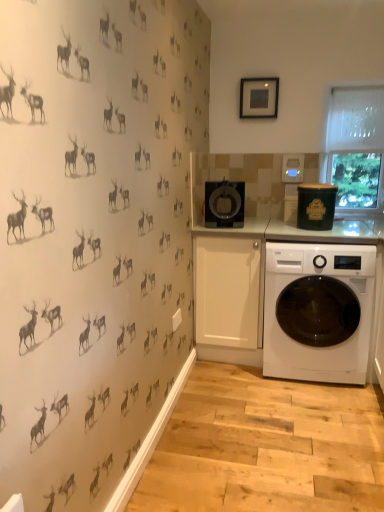
Question: In which direction should I rotate to look at black glossy coffee maker at center, the 1th appliance positioned from the left?

Choices:
 (A) left
 (B) right

Answer: (B)

Question: Is black glossy coffee maker at center, the 1th appliance positioned from the left, positioned beyond the bounds of matte black picture frame at upper center?

Choices:
 (A) no
 (B) yes

Answer: (B)

Question: From the image's perspective, is black glossy coffee maker at center, the 1th appliance positioned from the left, located above matte black picture frame at upper center?

Choices:
 (A) yes
 (B) no

Answer: (B)

Question: Is black glossy coffee maker at center, the 1th appliance positioned from the left, thinner than matte black picture frame at upper center?

Choices:
 (A) no
 (B) yes

Answer: (A)

Question: Can you confirm if black glossy coffee maker at center, the 1th appliance positioned from the left, is taller than matte black picture frame at upper center?

Choices:
 (A) no
 (B) yes

Answer: (B)

Question: Considering the relative sizes of black glossy coffee maker at center, which ranks as the 2th appliance in right-to-left order, and matte black picture frame at upper center in the image provided, is black glossy coffee maker at center, which ranks as the 2th appliance in right-to-left order, smaller than matte black picture frame at upper center?

Choices:
 (A) no
 (B) yes

Answer: (A)

Question: Is matte black picture frame at upper center surrounded by black glossy coffee maker at center, which ranks as the 2th appliance in right-to-left order?

Choices:
 (A) yes
 (B) no

Answer: (B)

Question: Can you confirm if white glossy washing machine at lower right is thinner than matte black picture frame at upper center?

Choices:
 (A) yes
 (B) no

Answer: (B)

Question: Can you confirm if white glossy washing machine at lower right is positioned to the left of matte black picture frame at upper center?

Choices:
 (A) no
 (B) yes

Answer: (A)

Question: From a real-world perspective, is white glossy washing machine at lower right over matte black picture frame at upper center?

Choices:
 (A) yes
 (B) no

Answer: (B)

Question: Is the position of white glossy washing machine at lower right more distant than that of matte black picture frame at upper center?

Choices:
 (A) yes
 (B) no

Answer: (B)

Question: From the image's perspective, does white glossy washing machine at lower right appear higher than matte black picture frame at upper center?

Choices:
 (A) no
 (B) yes

Answer: (A)

Question: Does white glossy washing machine at lower right turn towards matte black picture frame at upper center?

Choices:
 (A) no
 (B) yes

Answer: (A)

Question: Considering the relative sizes of black glossy coffee maker at center, which ranks as the 2th appliance in right-to-left order, and white glossy washing machine at lower right in the image provided, is black glossy coffee maker at center, which ranks as the 2th appliance in right-to-left order, thinner than white glossy washing machine at lower right?

Choices:
 (A) yes
 (B) no

Answer: (A)